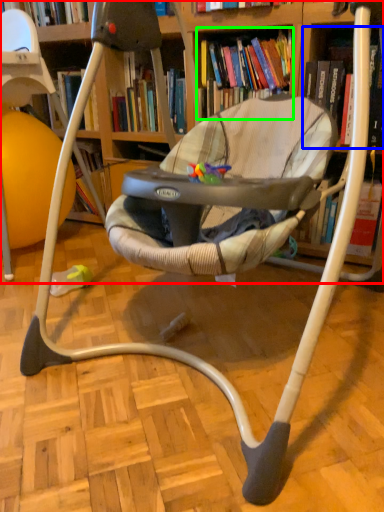
Question: Which is farther away from bookcase (highlighted by a red box)? book (highlighted by a blue box) or book (highlighted by a green box)?

Choices:
 (A) book
 (B) book

Answer: (A)